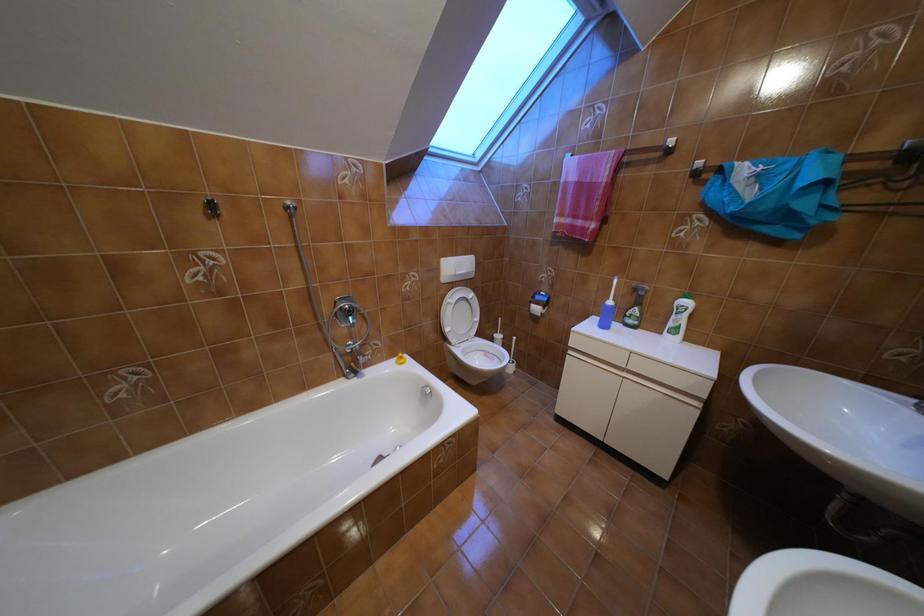
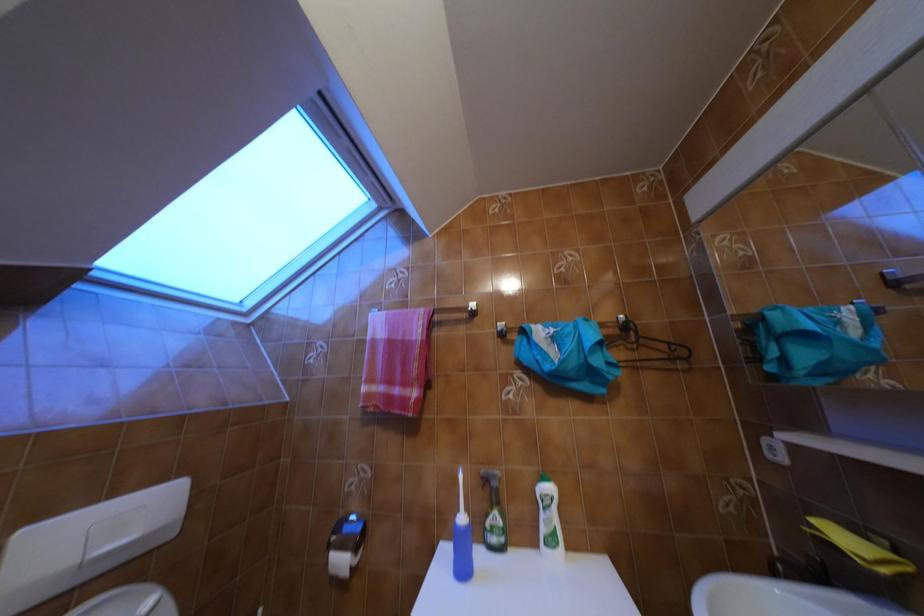
The images are taken continuously from a first-person perspective. In which direction is your viewpoint rotating?

The camera rotated toward right-up.